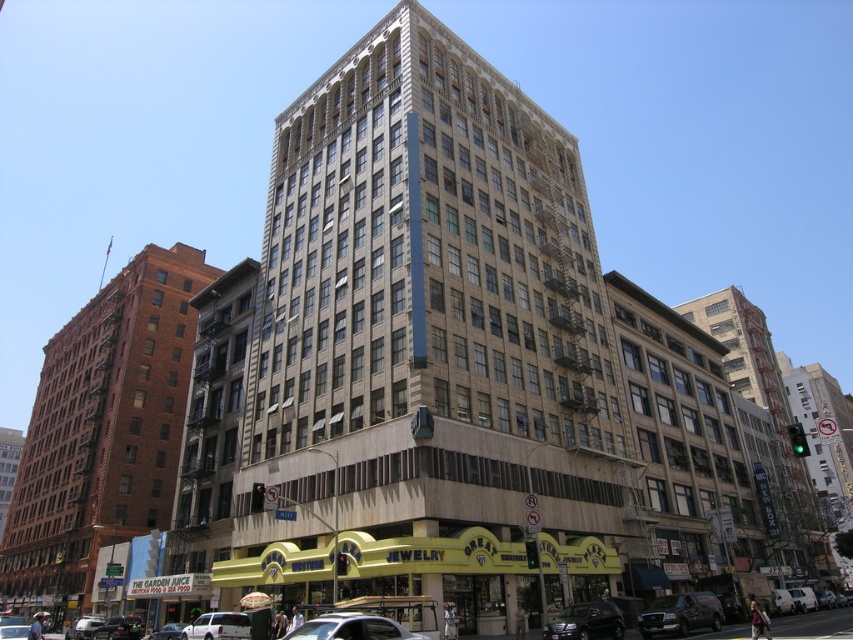
Between beige stone building at center and shiny black suv at lower center, which one has less height?

Standing shorter between the two is shiny black suv at lower center.

Is beige stone building at center shorter than shiny black suv at lower center?

No, beige stone building at center is not shorter than shiny black suv at lower center.

Where is `beige stone building at center`? This screenshot has width=853, height=640. beige stone building at center is located at coordinates (431, 346).

Can you confirm if shiny black suv at lower center is taller than white matte suv at center?

In fact, shiny black suv at lower center may be shorter than white matte suv at center.

Is shiny black suv at lower center to the right of white matte suv at center from the viewer's perspective?

Indeed, shiny black suv at lower center is positioned on the right side of white matte suv at center.

Image resolution: width=853 pixels, height=640 pixels. What do you see at coordinates (585, 621) in the screenshot?
I see `shiny black suv at lower center` at bounding box center [585, 621].

Where is `shiny black suv at lower center`? The width and height of the screenshot is (853, 640). shiny black suv at lower center is located at coordinates (585, 621).

Which is more to the right, white matte suv at center or shiny black sedan at center?

white matte suv at center

Is white matte suv at center behind shiny black sedan at center?

No, white matte suv at center is in front of shiny black sedan at center.

Between point (186, 628) and point (173, 625), which one is positioned in front?

Point (186, 628)

Where is `white matte suv at center`? white matte suv at center is located at coordinates tap(218, 627).